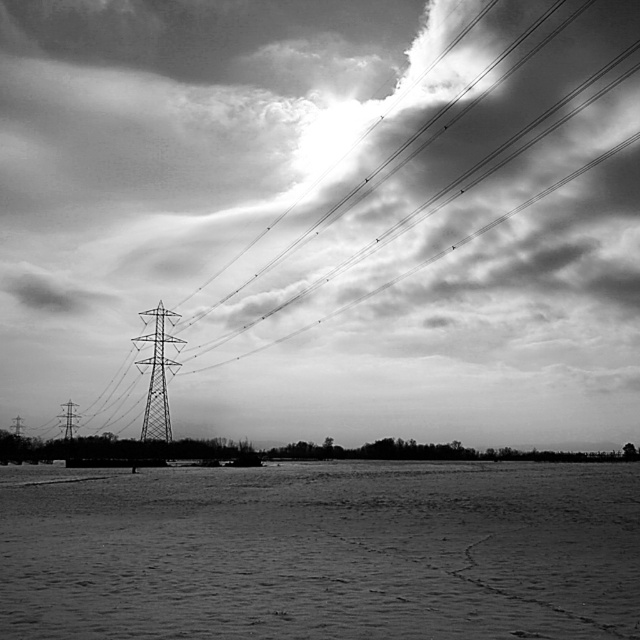
Does cloudy sky at upper center appear on the right side of metallic grid tower at left?

Correct, you'll find cloudy sky at upper center to the right of metallic grid tower at left.

Does cloudy sky at upper center have a smaller size compared to metallic grid tower at left?

Actually, cloudy sky at upper center might be larger than metallic grid tower at left.

Measure the distance between point (125, 428) and camera.

They are 145.58 meters apart.

At what (x,y) coordinates should I click in order to perform the action: click on cloudy sky at upper center. Please return your answer as a coordinate pair (x, y). Looking at the image, I should click on click(321, 216).

Consider the image. Can you confirm if metallic grid tower at center is bigger than metallic tower at left?

Indeed, metallic grid tower at center has a larger size compared to metallic tower at left.

Who is more forward, [150,406] or [74,422]?

Positioned in front is point [150,406].

What do you see at coordinates (157, 376) in the screenshot? This screenshot has width=640, height=640. I see `metallic grid tower at center` at bounding box center [157, 376].

The width and height of the screenshot is (640, 640). What are the coordinates of `metallic grid tower at center` in the screenshot? It's located at (157, 376).

From the picture: Can you confirm if smooth sand at lower center is wider than metallic grid tower at center?

Yes.

Image resolution: width=640 pixels, height=640 pixels. In order to click on smooth sand at lower center in this screenshot , I will do `click(323, 552)`.